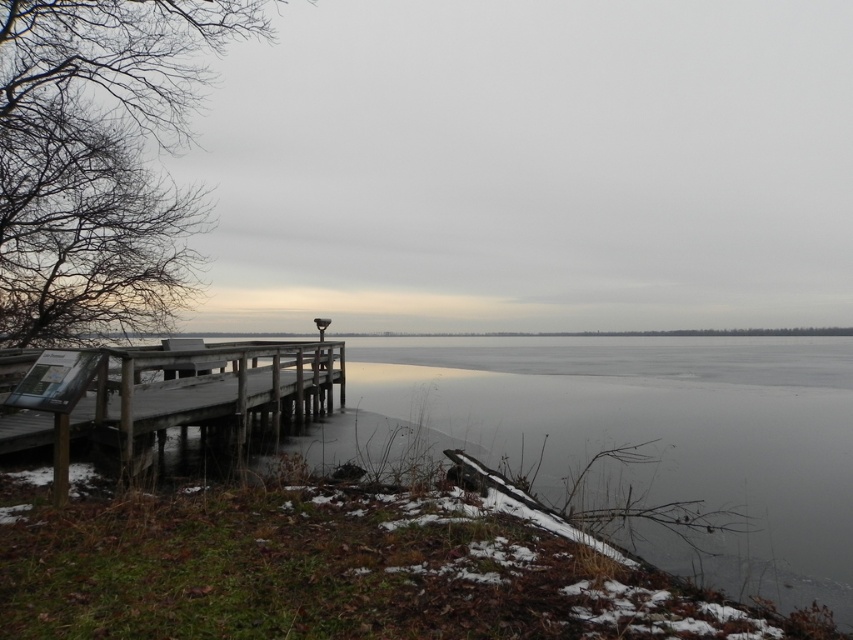
You are planning to walk across the wooden dock at lower left to reach a boat in the distance. However, you notice the transparent ice at lower center nearby. Considering their sizes, which one is wider so you can decide the safest path?

The transparent ice at lower center is wider than the wooden dock at lower left, so it might be safer to walk on the transparent ice at lower center if it can support your weight.